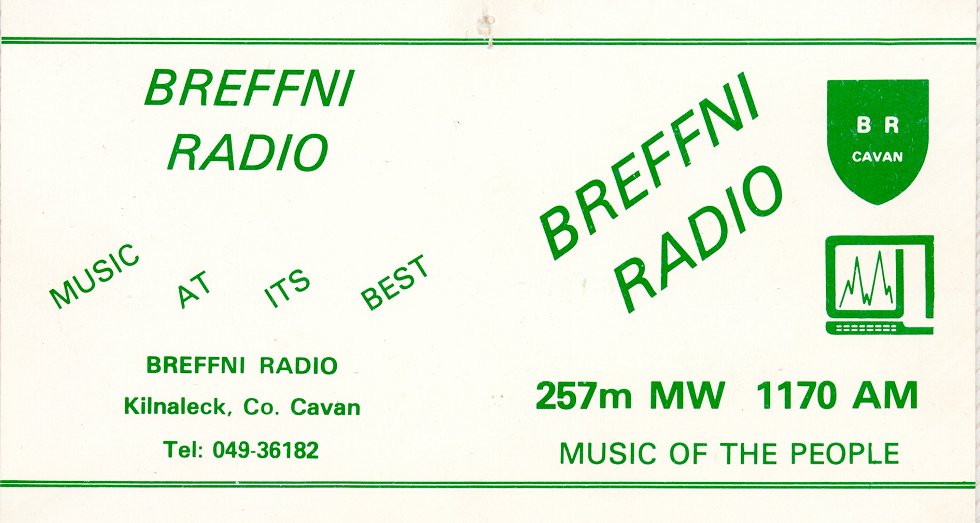
Identify the location of radio. (249, 159), (289, 363), (702, 245).